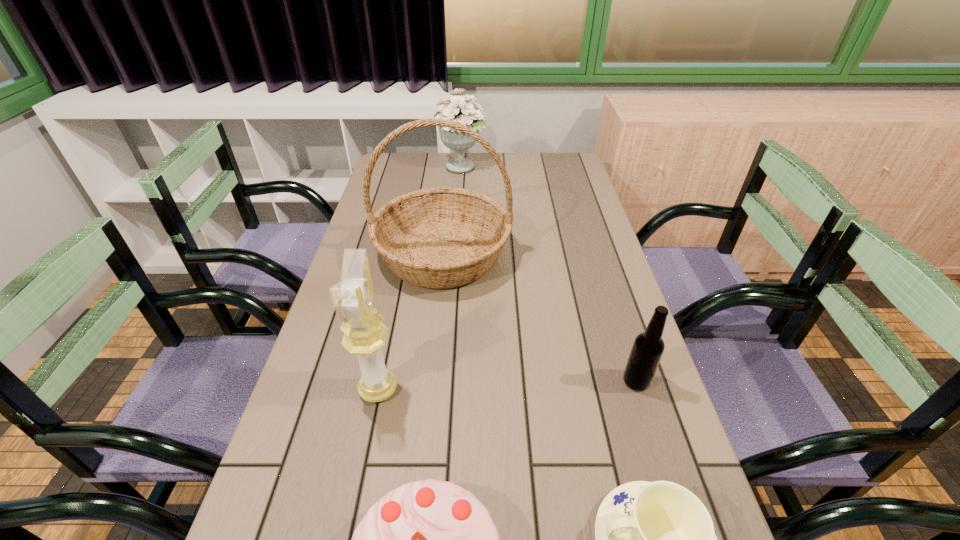
Find the location of a particular element. The height and width of the screenshot is (540, 960). the tallest object is located at coordinates (444, 237).

Image resolution: width=960 pixels, height=540 pixels. Identify the location of basket. (444, 237).

Find the location of `award`. award is located at coordinates (353, 297).

Locate an element on the screen. The width and height of the screenshot is (960, 540). the farthest object is located at coordinates (469, 114).

I want to click on beer bottle, so click(647, 350).

Locate an element on the screen. The width and height of the screenshot is (960, 540). vacant space situated 0.330m on the back of the basket is located at coordinates (451, 171).

Identify the location of vacant region located on the front-facing side of the award. (492, 389).

In order to click on free region located 0.180m on the front of the farthest object in this screenshot , I will do `click(460, 207)`.

Image resolution: width=960 pixels, height=540 pixels. What are the coordinates of `vacant space located 0.310m on the left of the beer bottle` in the screenshot? It's located at (484, 381).

This screenshot has height=540, width=960. In order to click on object that is at the far edge in this screenshot , I will do `click(469, 114)`.